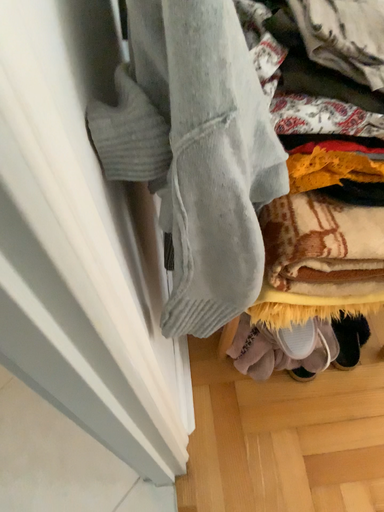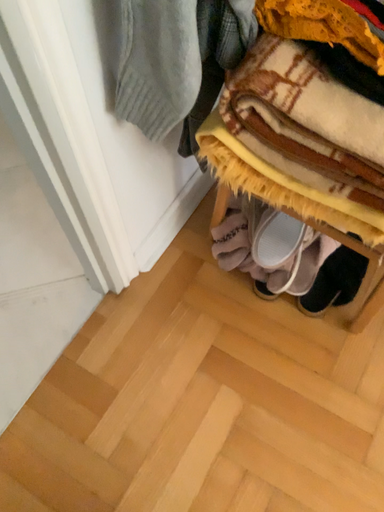
Question: How did the camera likely rotate when shooting the video?

Choices:
 (A) rotated right
 (B) rotated left

Answer: (B)